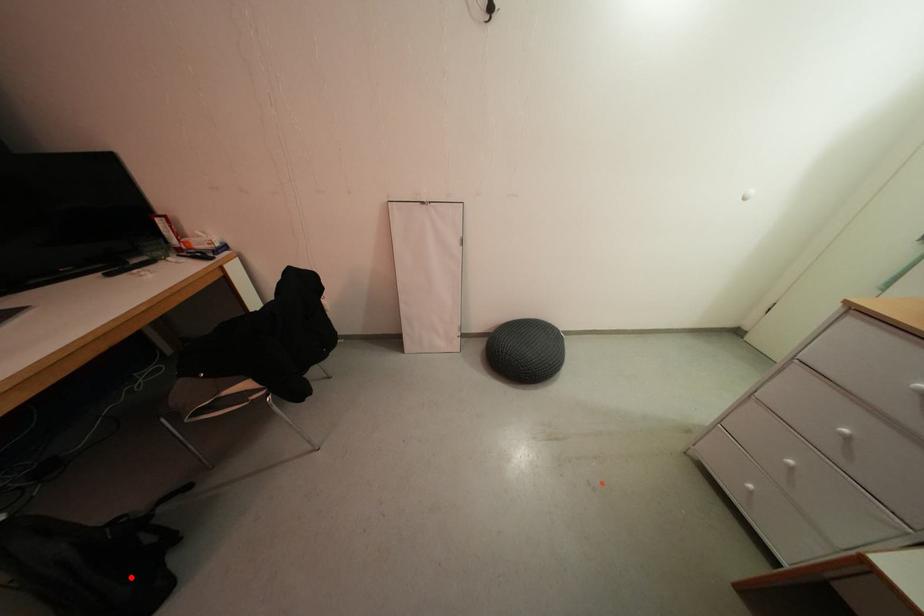
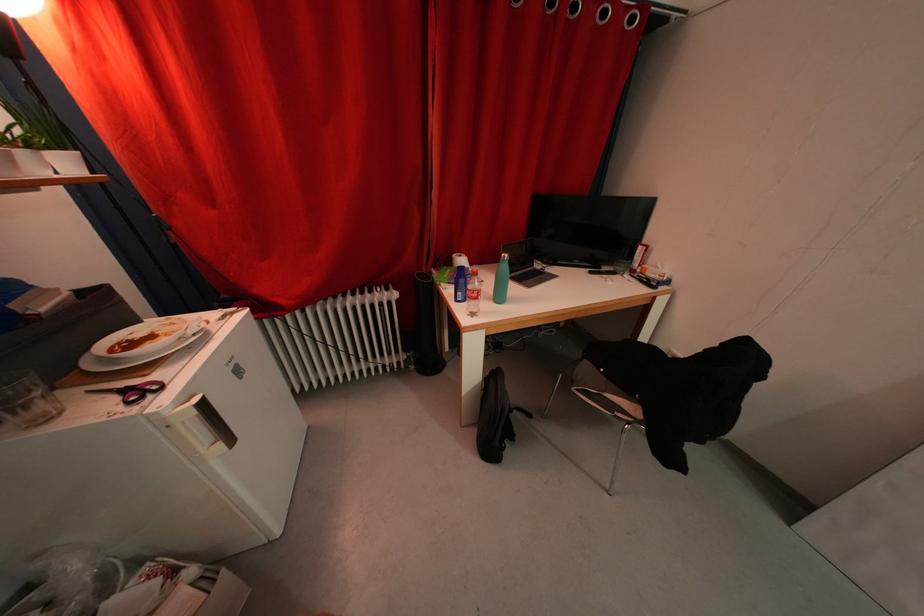
Locate, in the second image, the point that corresponds to the highlighted location in the first image.

(500, 432)